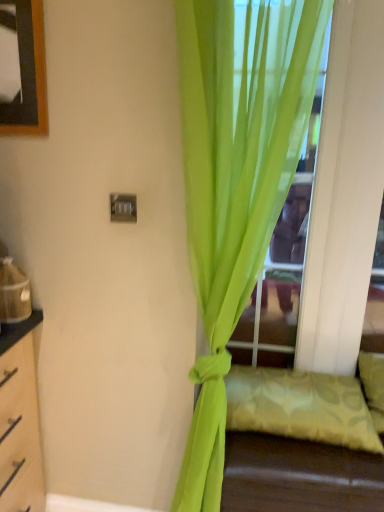
Question: Is point (253, 415) positioned closer to the camera than point (251, 15)?

Choices:
 (A) farther
 (B) closer

Answer: (A)

Question: Is light green fabric pillow at lower right to the left or to the right of transparent glass door at center in the image?

Choices:
 (A) left
 (B) right

Answer: (B)

Question: Which is farther from the light green fabric pillow at lower right?

Choices:
 (A) transparent glass door at center
 (B) lime green sheer curtain at center

Answer: (A)

Question: Which of these objects is positioned closest to the transparent glass door at center?

Choices:
 (A) lime green sheer curtain at center
 (B) light green fabric pillow at lower right

Answer: (A)